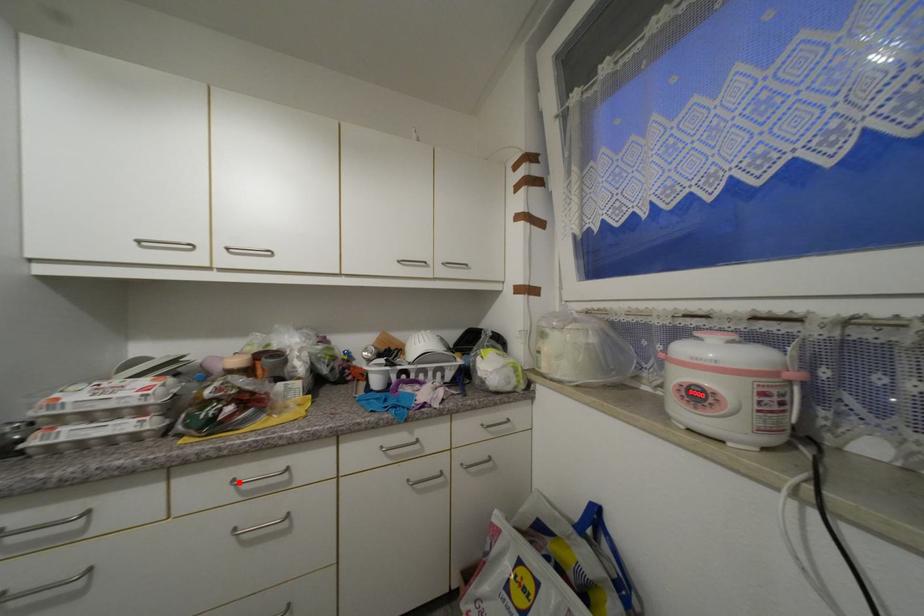
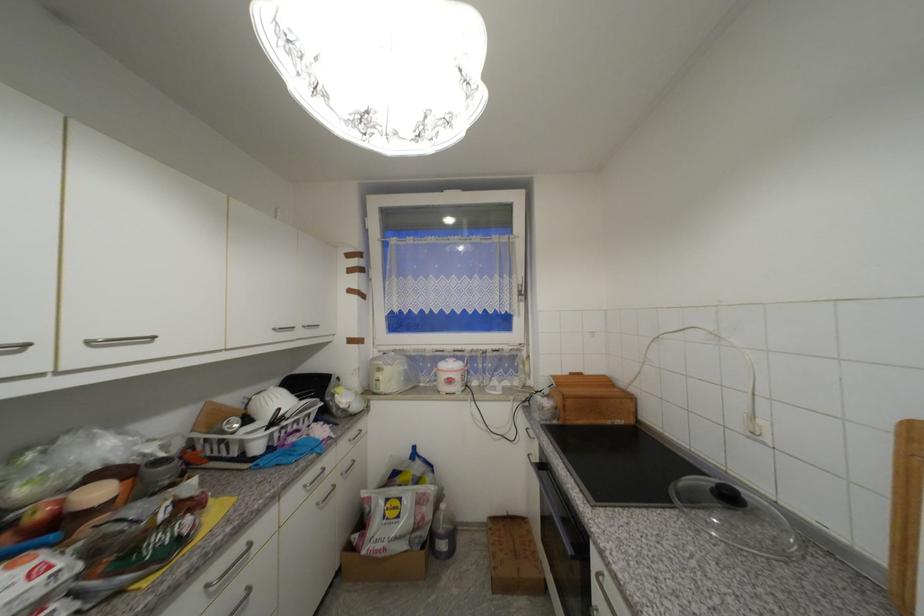
The point at the highlighted location is marked in the first image. Where is the corresponding point in the second image?

(213, 588)